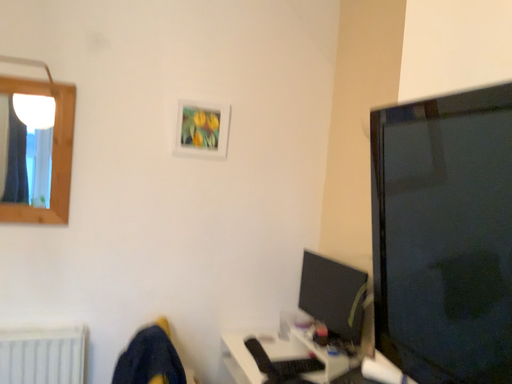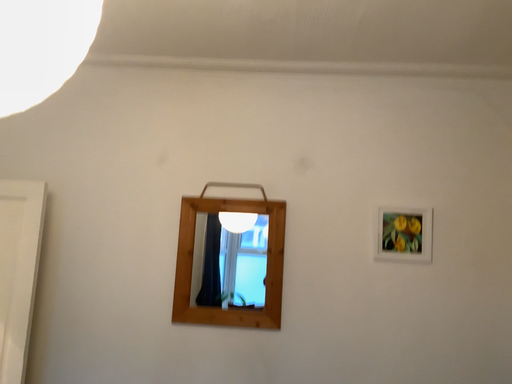
Question: How did the camera likely rotate when shooting the video?

Choices:
 (A) rotated upward
 (B) rotated downward

Answer: (A)